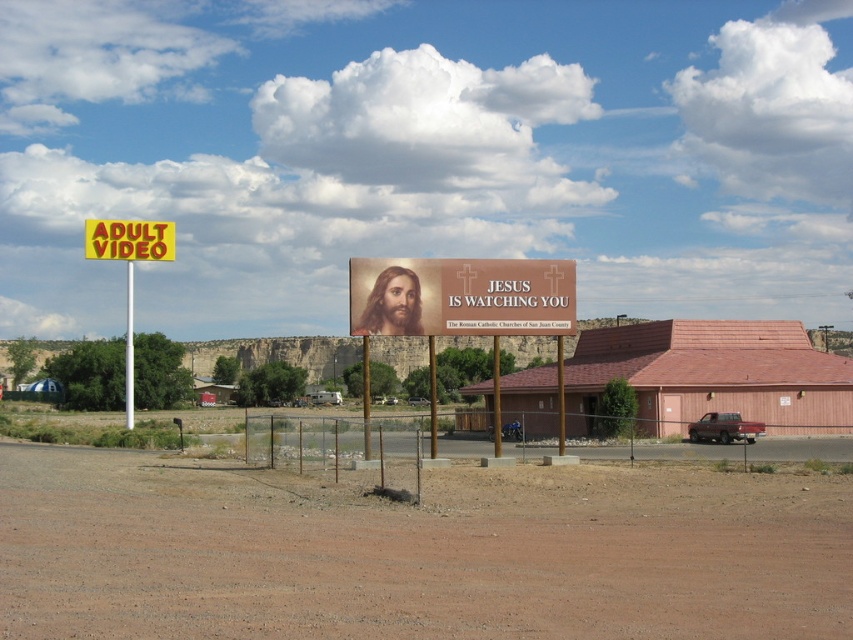
Question: Considering the real-world distances, which object is farthest from the white plastic pole at upper left?

Choices:
 (A) yellow plastic sign at upper left
 (B) yellow plastic sign at left

Answer: (A)

Question: Which point appears closest to the camera in this image?

Choices:
 (A) (94, 234)
 (B) (474, 307)

Answer: (B)

Question: Among these points, which one is farthest from the camera?

Choices:
 (A) (131, 282)
 (B) (126, 372)
 (C) (155, 236)
 (D) (488, 328)

Answer: (A)

Question: Can you confirm if yellow plastic sign at left is bigger than white plastic pole at upper left?

Choices:
 (A) yes
 (B) no

Answer: (A)

Question: Is matte brown sign at center positioned at the back of yellow plastic sign at upper left?

Choices:
 (A) no
 (B) yes

Answer: (A)

Question: Is yellow plastic sign at upper left thinner than white plastic pole at upper left?

Choices:
 (A) no
 (B) yes

Answer: (B)